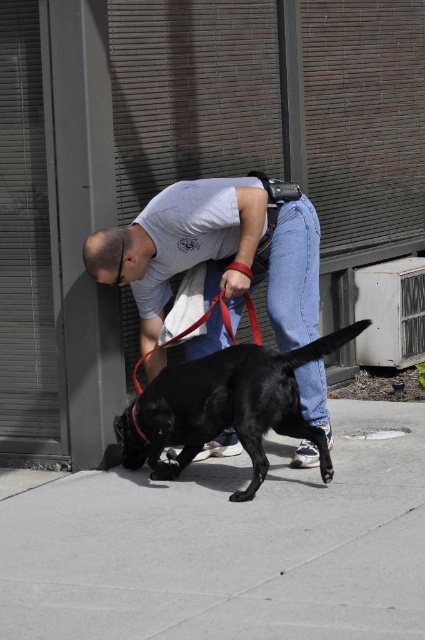
Question: Is shiny black dog at center thinner than red nylon leash at lower center?

Choices:
 (A) yes
 (B) no

Answer: (B)

Question: Can you confirm if shiny black dog at center is thinner than red nylon leash at lower center?

Choices:
 (A) yes
 (B) no

Answer: (B)

Question: Which point is closer to the camera taking this photo?

Choices:
 (A) (254, 429)
 (B) (181, 484)
 (C) (257, 275)
 (D) (226, 323)

Answer: (A)

Question: Does smooth concrete sidewalk at lower center have a lesser width compared to shiny black dog at center?

Choices:
 (A) yes
 (B) no

Answer: (B)

Question: Which object appears closest to the camera in this image?

Choices:
 (A) shiny black dog at center
 (B) matte black shirt at center
 (C) smooth concrete sidewalk at lower center
 (D) red nylon leash at lower center

Answer: (C)

Question: Among these objects, which one is nearest to the camera?

Choices:
 (A) matte black shirt at center
 (B) smooth concrete sidewalk at lower center

Answer: (B)